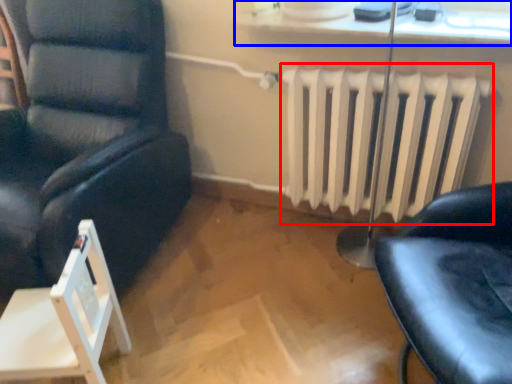
Question: Which object is further to the camera taking this photo, radiator (highlighted by a red box) or window sill (highlighted by a blue box)?

Choices:
 (A) radiator
 (B) window sill

Answer: (A)